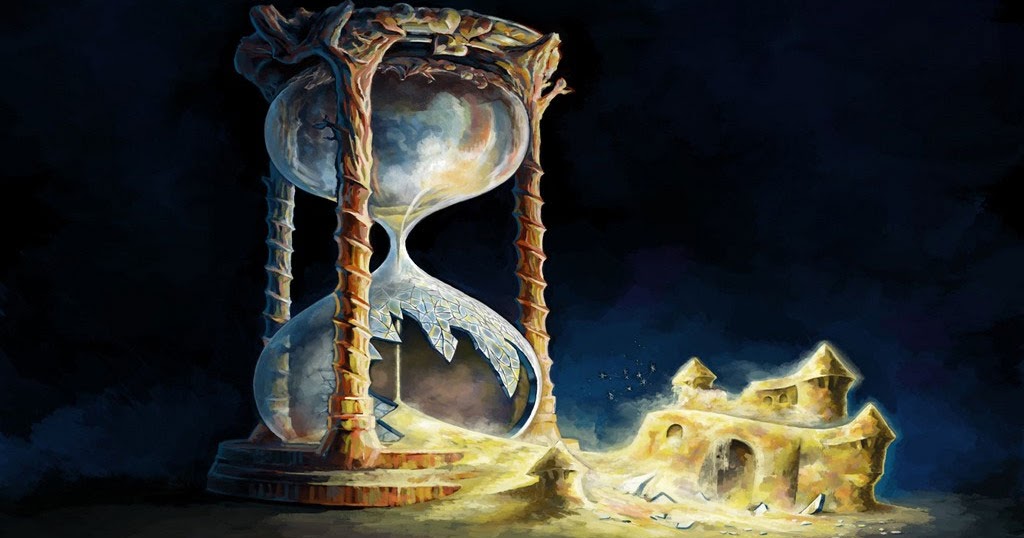
You are a GUI agent. You are given a task and a screenshot of the screen. Output one action in this format:
    pyautogui.click(x=<x>, y=<y>)
    Task: Click on the broken glass on the ground
    Image resolution: width=1024 pixels, height=538 pixels.
    Given the screenshot: What is the action you would take?
    pyautogui.click(x=658, y=495), pyautogui.click(x=815, y=502)